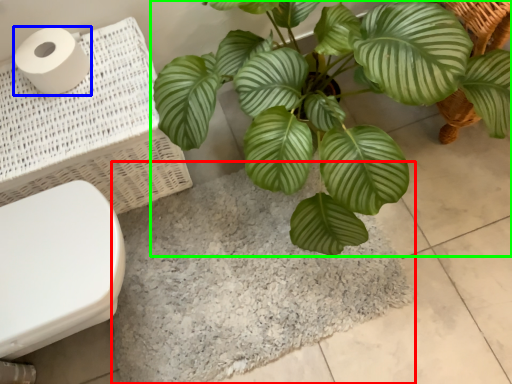
Question: Which object is the farthest from bath mat (highlighted by a red box)? Choose among these: toilet paper (highlighted by a blue box) or houseplant (highlighted by a green box).

Choices:
 (A) toilet paper
 (B) houseplant

Answer: (A)